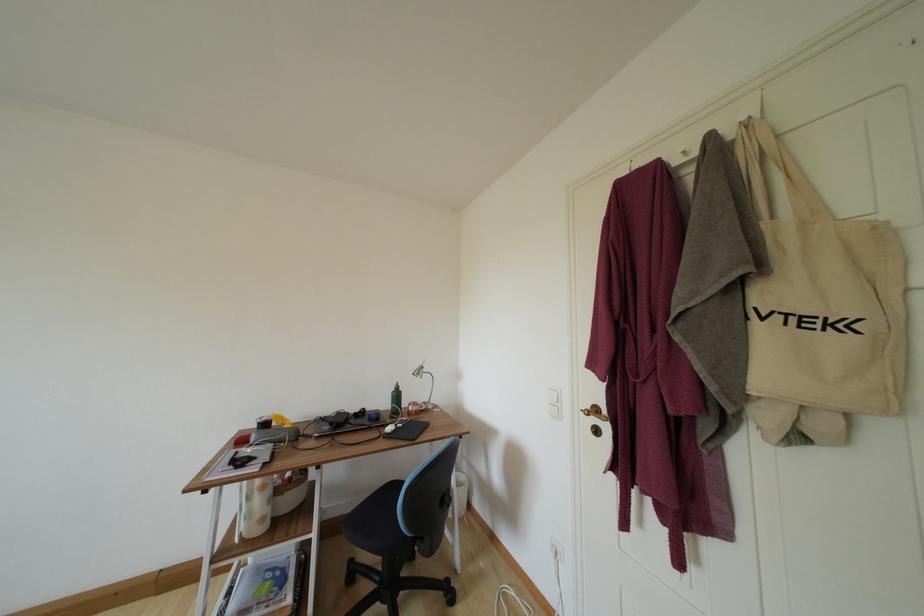
Image resolution: width=924 pixels, height=616 pixels. I want to click on chair sitting surface, so click(374, 512).